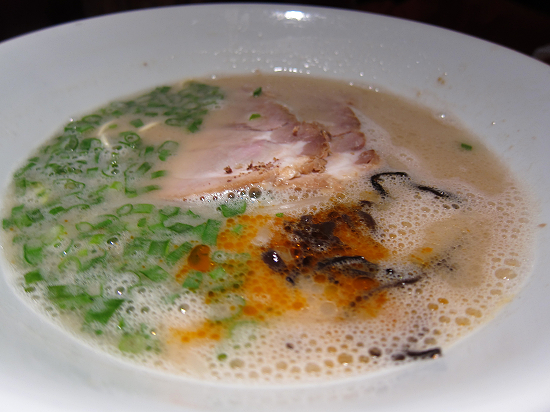
Where is `rim of bowl`? rim of bowl is located at coordinates (478, 37), (28, 32), (251, 3).